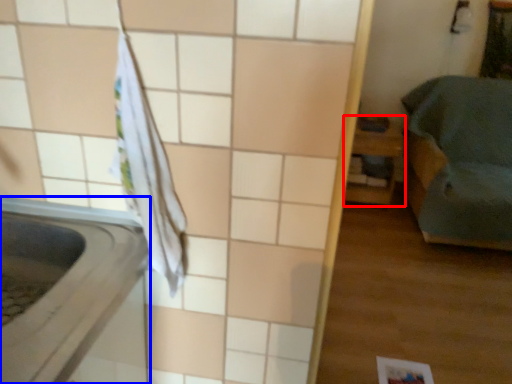
Question: Among these objects, which one is nearest to the camera, furniture (highlighted by a red box) or appliance (highlighted by a blue box)?

Choices:
 (A) furniture
 (B) appliance

Answer: (B)